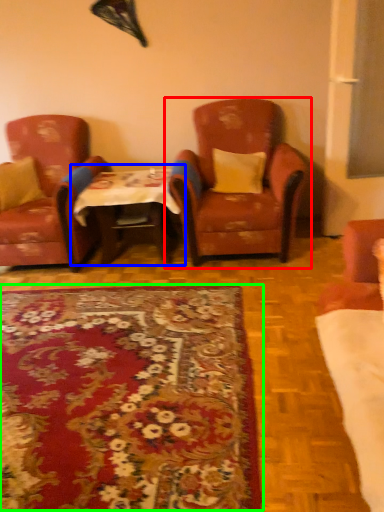
Question: Which is farther away from chair (highlighted by a red box)? table (highlighted by a blue box) or mat (highlighted by a green box)?

Choices:
 (A) table
 (B) mat

Answer: (B)